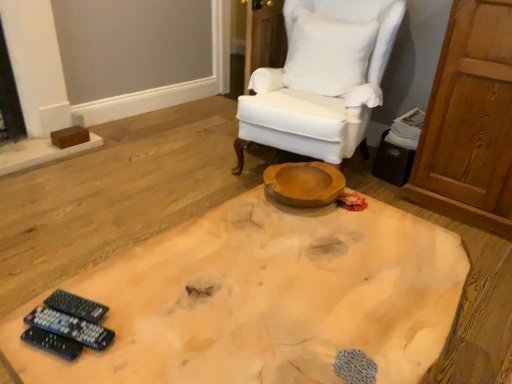
The width and height of the screenshot is (512, 384). Identify the location of vacant area that lies in front of black plastic remote controls at lower left, which is counted as the 2th remote control, starting from the front. (51, 363).